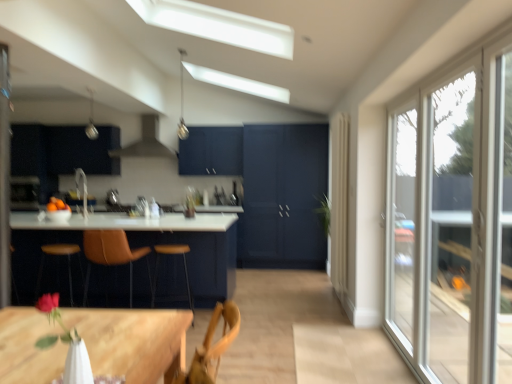
Question: Can you confirm if orange matte bowl at left is taller than brown leather bar stool at left, the second bar stool in the right-to-left sequence?

Choices:
 (A) yes
 (B) no

Answer: (B)

Question: From a real-world perspective, does orange matte bowl at left stand above brown leather bar stool at left, arranged as the 1th bar stool when viewed from the left?

Choices:
 (A) no
 (B) yes

Answer: (B)

Question: Is orange matte bowl at left to the left of brown leather bar stool at left, arranged as the 1th bar stool when viewed from the left, from the viewer's perspective?

Choices:
 (A) no
 (B) yes

Answer: (B)

Question: Is orange matte bowl at left outside of brown leather bar stool at left, the second bar stool in the right-to-left sequence?

Choices:
 (A) yes
 (B) no

Answer: (A)

Question: Is orange matte bowl at left turned away from brown leather bar stool at left, arranged as the 1th bar stool when viewed from the left?

Choices:
 (A) no
 (B) yes

Answer: (A)

Question: From a real-world perspective, relative to matte black cabinet at upper left, is matte white exhaust hood at upper center vertically above or below?

Choices:
 (A) below
 (B) above

Answer: (B)

Question: Choose the correct answer: Is matte white exhaust hood at upper center inside matte black cabinet at upper left or outside it?

Choices:
 (A) outside
 (B) inside

Answer: (A)

Question: Is matte white exhaust hood at upper center bigger or smaller than matte black cabinet at upper left?

Choices:
 (A) big
 (B) small

Answer: (A)

Question: From the image's perspective, relative to matte black cabinet at upper left, is matte white exhaust hood at upper center above or below?

Choices:
 (A) above
 (B) below

Answer: (A)

Question: Relative to wooden table at lower left, which appears as the 2th table when viewed from the back, is silver metallic light fixture at upper center, the 2th light fixture from the right, in front or behind?

Choices:
 (A) front
 (B) behind

Answer: (B)

Question: From the image's perspective, relative to wooden table at lower left, which appears as the 2th table when viewed from the back, is silver metallic light fixture at upper center, the 2th light fixture from the right, above or below?

Choices:
 (A) below
 (B) above

Answer: (B)

Question: Is silver metallic light fixture at upper center, which ranks as the 1th light fixture in left-to-right order, wider or thinner than wooden table at lower left, which appears as the 2th table when viewed from the back?

Choices:
 (A) wide
 (B) thin

Answer: (B)

Question: Is point (96, 134) positioned closer to the camera than point (82, 319)?

Choices:
 (A) farther
 (B) closer

Answer: (A)

Question: Considering their positions, is metallic pendant light at upper center, the second light fixture positioned from the left, located in front of or behind wooden table at lower left, the 1th table when ordered from left to right?

Choices:
 (A) front
 (B) behind

Answer: (B)

Question: Based on their sizes in the image, would you say metallic pendant light at upper center, arranged as the first light fixture when viewed from the right, is bigger or smaller than wooden table at lower left, the 2th table when ordered from front to back?

Choices:
 (A) big
 (B) small

Answer: (B)